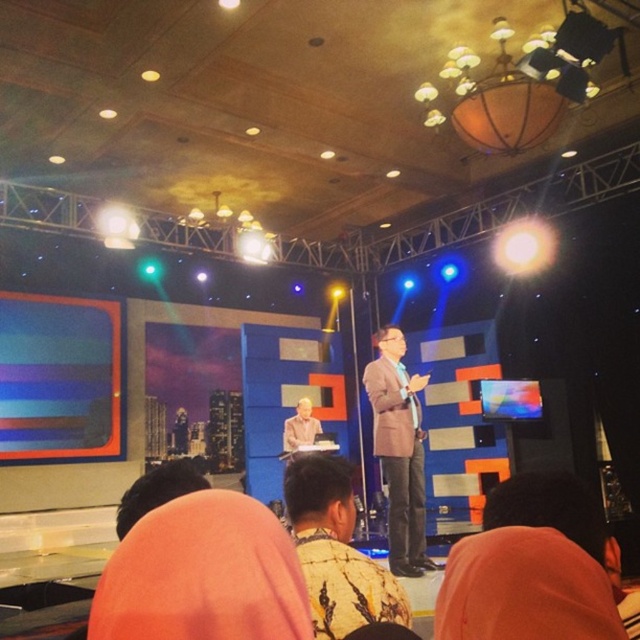
Question: Does patterned fabric shirt at center come behind brown textured suit at center?

Choices:
 (A) yes
 (B) no

Answer: (B)

Question: Where is patterned fabric shirt at center located in relation to light brown wood desk at center in the image?

Choices:
 (A) right
 (B) left

Answer: (A)

Question: Which object appears farthest from the camera in this image?

Choices:
 (A) light brown wood desk at center
 (B) brown textured suit at center

Answer: (A)

Question: Which point is farther to the camera?

Choices:
 (A) patterned fabric shirt at center
 (B) orange fabric at lower right
 (C) light brown wood desk at center

Answer: (C)

Question: Does patterned fabric shirt at center appear under orange fabric at lower right?

Choices:
 (A) no
 (B) yes

Answer: (B)

Question: Which point appears farthest from the camera in this image?

Choices:
 (A) (380, 376)
 (B) (314, 426)
 (C) (592, 520)

Answer: (B)